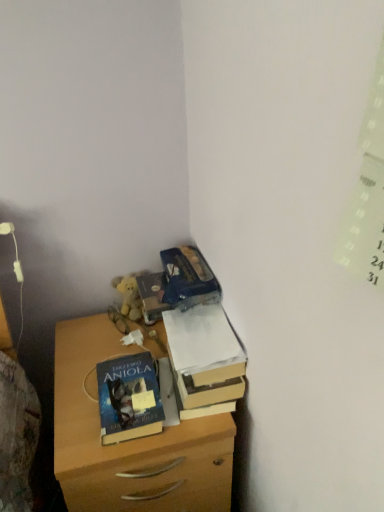
Question: From the image's perspective, is blue matte book at center on top of cardboard box at upper right?

Choices:
 (A) no
 (B) yes

Answer: (A)

Question: Is blue matte book at center at the right side of cardboard box at upper right?

Choices:
 (A) no
 (B) yes

Answer: (A)

Question: From a real-world perspective, is blue matte book at center on top of cardboard box at upper right?

Choices:
 (A) no
 (B) yes

Answer: (A)

Question: Can we say blue matte book at center lies outside cardboard box at upper right?

Choices:
 (A) no
 (B) yes

Answer: (B)

Question: Is blue matte book at center facing towards cardboard box at upper right?

Choices:
 (A) yes
 (B) no

Answer: (B)

Question: From the image's perspective, relative to cardboard box at upper right, is blue matte book at center above or below?

Choices:
 (A) above
 (B) below

Answer: (B)

Question: Would you say blue matte book at center is inside or outside cardboard box at upper right?

Choices:
 (A) outside
 (B) inside

Answer: (A)

Question: Does point (125, 436) appear closer or farther from the camera than point (183, 401)?

Choices:
 (A) closer
 (B) farther

Answer: (A)

Question: Is blue matte book at center bigger or smaller than cardboard box at upper right?

Choices:
 (A) big
 (B) small

Answer: (B)

Question: In terms of width, does cardboard box at upper right look wider or thinner when compared to wooden chest of drawers at lower left?

Choices:
 (A) thin
 (B) wide

Answer: (A)

Question: Is cardboard box at upper right in front of or behind wooden chest of drawers at lower left in the image?

Choices:
 (A) front
 (B) behind

Answer: (B)

Question: Considering the relative positions of cardboard box at upper right and wooden chest of drawers at lower left in the image provided, is cardboard box at upper right to the left or to the right of wooden chest of drawers at lower left?

Choices:
 (A) left
 (B) right

Answer: (B)

Question: Is cardboard box at upper right bigger or smaller than wooden chest of drawers at lower left?

Choices:
 (A) big
 (B) small

Answer: (B)

Question: In the image, is blue matte book at center positioned in front of or behind wooden chest of drawers at lower left?

Choices:
 (A) behind
 (B) front

Answer: (A)

Question: Considering the positions of point (125, 372) and point (97, 339), is point (125, 372) closer or farther from the camera than point (97, 339)?

Choices:
 (A) closer
 (B) farther

Answer: (A)